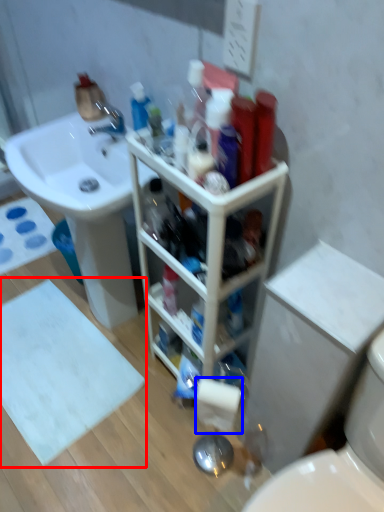
Question: Which object is closer to the camera taking this photo, bath mat (highlighted by a red box) or toilet paper (highlighted by a blue box)?

Choices:
 (A) bath mat
 (B) toilet paper

Answer: (B)